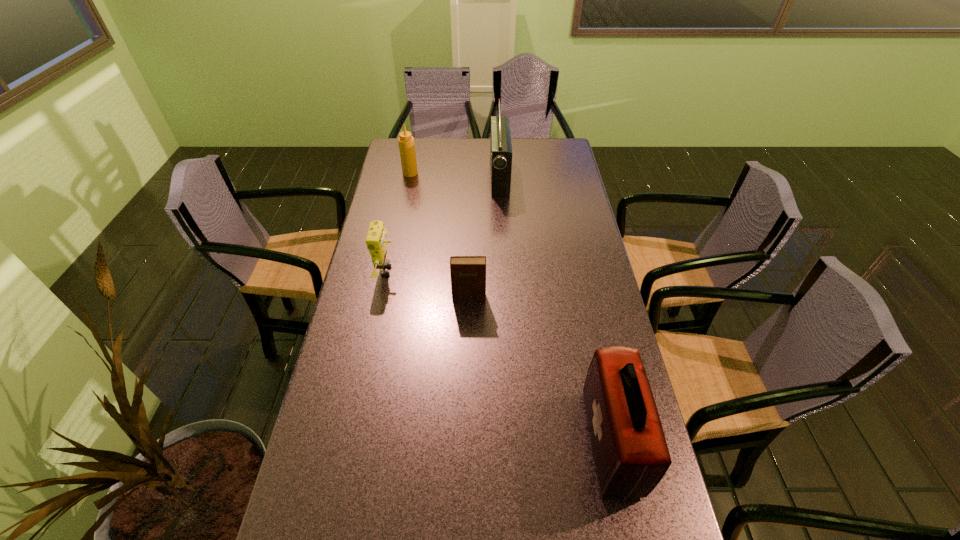
This screenshot has width=960, height=540. In the image, there is a desktop. Identify the location of vacant space at the left edge. (359, 323).

In the image, there is a desktop. Identify the location of vacant space at the right edge. (582, 357).

At what (x,y) coordinates should I click in order to perform the action: click on free spot between the diary and the first aid kit. Please return your answer as a coordinate pair (x, y). This screenshot has height=540, width=960. Looking at the image, I should click on (540, 370).

In order to click on free space between the radio receiver and the diary in this screenshot , I will do `click(484, 237)`.

The height and width of the screenshot is (540, 960). In order to click on vacant area between the third object from right to left and the rightmost object in this screenshot , I will do `click(540, 370)`.

Find the location of a particular element. Image resolution: width=960 pixels, height=540 pixels. empty space between the radio receiver and the sponge is located at coordinates (444, 224).

The image size is (960, 540). Find the location of `free space between the sponge and the diary`. free space between the sponge and the diary is located at coordinates (428, 285).

Locate an element on the screen. The width and height of the screenshot is (960, 540). free space that is in between the sponge and the third shortest object is located at coordinates (398, 222).

You are a GUI agent. You are given a task and a screenshot of the screen. Output one action in this format:
    pyautogui.click(x=<x>, y=<y>)
    Task: Click on the free space between the condiment and the radio receiver
    Image resolution: width=960 pixels, height=540 pixels.
    Given the screenshot: What is the action you would take?
    pyautogui.click(x=455, y=175)

Where is `free space that is in between the condiment and the second object from right to left`? free space that is in between the condiment and the second object from right to left is located at coordinates (455, 175).